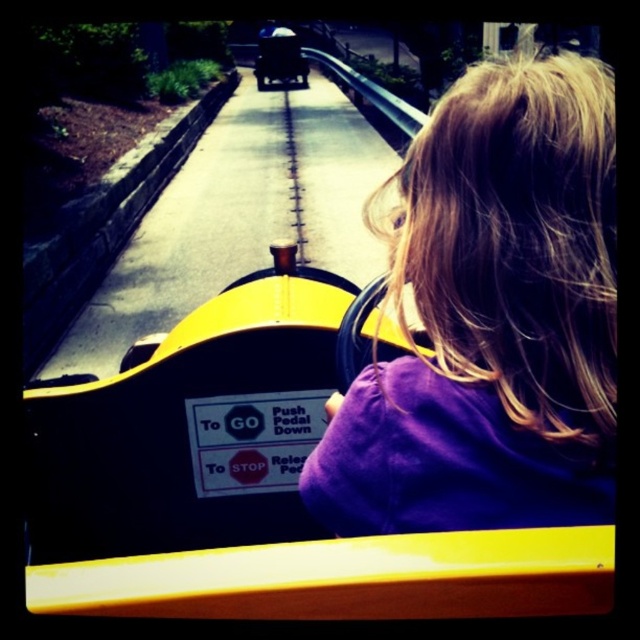
You are a photographer trying to capture the child in the yellow and black ride on vehicle. You notice a point marked at coordinates (492,317). What object is located at this point?

The point at (492,317) marks the purple fabric hair at center.

You are a parent standing behind the purple fabric hair at center and the shiny black car at center. You want to ensure the child is safe. Which object is closer to the ground? Please answer based on their positions.

The purple fabric hair at center is located below shiny black car at center, so the purple fabric hair at center is closer to the ground.

You are a parent watching your child in the amusement park. You see the purple fabric hair at center and the shiny black car at center. Which object takes up more space in the image?

The shiny black car at center takes up more space in the image because the purple fabric hair at center occupies less space than the shiny black car at center.